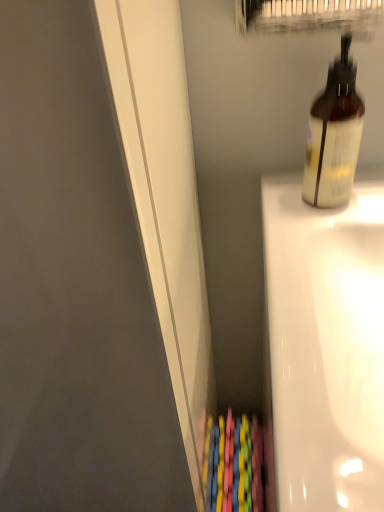
Question: Would you say white glossy bathtub at right contains translucent plastic bottle at upper right?

Choices:
 (A) no
 (B) yes

Answer: (A)

Question: Considering the relative sizes of white glossy bathtub at right and translucent plastic bottle at upper right in the image provided, is white glossy bathtub at right shorter than translucent plastic bottle at upper right?

Choices:
 (A) yes
 (B) no

Answer: (B)

Question: From the image's perspective, is white glossy bathtub at right beneath translucent plastic bottle at upper right?

Choices:
 (A) no
 (B) yes

Answer: (B)

Question: Is white glossy bathtub at right positioned with its back to translucent plastic bottle at upper right?

Choices:
 (A) yes
 (B) no

Answer: (B)

Question: Considering the relative sizes of white glossy bathtub at right and translucent plastic bottle at upper right in the image provided, is white glossy bathtub at right smaller than translucent plastic bottle at upper right?

Choices:
 (A) yes
 (B) no

Answer: (B)

Question: Considering the relative positions of white glossy bathtub at right and translucent plastic bottle at upper right in the image provided, is white glossy bathtub at right to the right of translucent plastic bottle at upper right from the viewer's perspective?

Choices:
 (A) yes
 (B) no

Answer: (A)

Question: Can you confirm if translucent plastic bottle at upper right is wider than white glossy bathtub at right?

Choices:
 (A) yes
 (B) no

Answer: (B)

Question: Is translucent plastic bottle at upper right oriented towards white glossy bathtub at right?

Choices:
 (A) no
 (B) yes

Answer: (A)

Question: Does translucent plastic bottle at upper right have a smaller size compared to white glossy bathtub at right?

Choices:
 (A) yes
 (B) no

Answer: (A)

Question: From a real-world perspective, is translucent plastic bottle at upper right physically above white glossy bathtub at right?

Choices:
 (A) yes
 (B) no

Answer: (A)

Question: Is translucent plastic bottle at upper right closer to the viewer compared to white glossy bathtub at right?

Choices:
 (A) no
 (B) yes

Answer: (A)

Question: Is translucent plastic bottle at upper right with white glossy bathtub at right?

Choices:
 (A) no
 (B) yes

Answer: (A)

Question: From a real-world perspective, is white glossy bathtub at right positioned above or below translucent plastic bottle at upper right?

Choices:
 (A) above
 (B) below

Answer: (B)